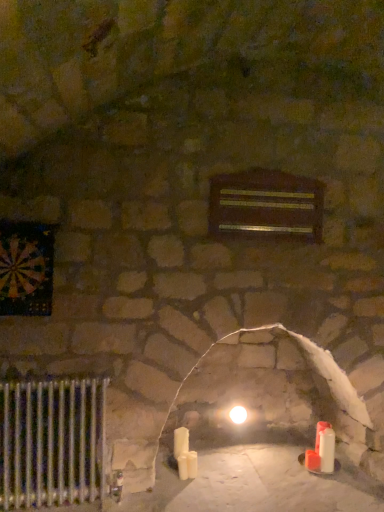
Question: Considering the relative positions of white glossy light bulb at center and wooden plaque at center in the image provided, is white glossy light bulb at center to the right of wooden plaque at center from the viewer's perspective?

Choices:
 (A) yes
 (B) no

Answer: (B)

Question: Is the position of white glossy light bulb at center less distant than that of wooden plaque at center?

Choices:
 (A) no
 (B) yes

Answer: (A)

Question: From the image's perspective, is white glossy light bulb at center below wooden plaque at center?

Choices:
 (A) yes
 (B) no

Answer: (A)

Question: Is white glossy light bulb at center taller than wooden plaque at center?

Choices:
 (A) yes
 (B) no

Answer: (B)

Question: Considering the relative sizes of white glossy light bulb at center and wooden plaque at center in the image provided, is white glossy light bulb at center bigger than wooden plaque at center?

Choices:
 (A) no
 (B) yes

Answer: (A)

Question: From the image's perspective, relative to wooden plaque at center, is white glossy light bulb at center above or below?

Choices:
 (A) below
 (B) above

Answer: (A)

Question: Considering the positions of white glossy light bulb at center and wooden plaque at center in the image, is white glossy light bulb at center wider or thinner than wooden plaque at center?

Choices:
 (A) thin
 (B) wide

Answer: (B)

Question: Considering the positions of white glossy light bulb at center and wooden plaque at center in the image, is white glossy light bulb at center bigger or smaller than wooden plaque at center?

Choices:
 (A) small
 (B) big

Answer: (A)

Question: Is point (235, 414) positioned closer to the camera than point (284, 181)?

Choices:
 (A) farther
 (B) closer

Answer: (A)

Question: Choose the correct answer: Is silver metallic radiator at lower left inside white wax candle at center, marked as the 3th candle in a right-to-left arrangement, or outside it?

Choices:
 (A) outside
 (B) inside

Answer: (A)

Question: Considering the positions of silver metallic radiator at lower left and white wax candle at center, marked as the 3th candle in a right-to-left arrangement, in the image, is silver metallic radiator at lower left wider or thinner than white wax candle at center, marked as the 3th candle in a right-to-left arrangement,?

Choices:
 (A) thin
 (B) wide

Answer: (B)

Question: In terms of height, does silver metallic radiator at lower left look taller or shorter compared to white wax candle at center, which is the 1th candle from left to right?

Choices:
 (A) tall
 (B) short

Answer: (A)

Question: Considering the positions of point (74, 476) and point (178, 452), is point (74, 476) closer or farther from the camera than point (178, 452)?

Choices:
 (A) farther
 (B) closer

Answer: (B)

Question: From a real-world perspective, is white matte candle at lower right, the 3th candle in the left-to-right sequence, above or below silver metallic radiator at lower left?

Choices:
 (A) below
 (B) above

Answer: (A)

Question: Considering the positions of white matte candle at lower right, the first candle in the right-to-left sequence, and silver metallic radiator at lower left in the image, is white matte candle at lower right, the first candle in the right-to-left sequence, taller or shorter than silver metallic radiator at lower left?

Choices:
 (A) short
 (B) tall

Answer: (A)